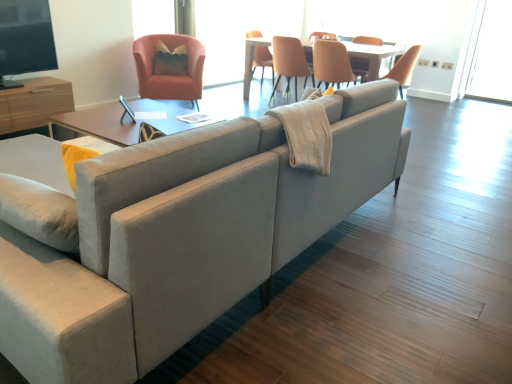
Question: Can you confirm if matte orange chair at upper center, which is the 2th chair from right to left, is bigger than leather-like beige chair at center, marked as the third chair in a left-to-right arrangement?

Choices:
 (A) no
 (B) yes

Answer: (B)

Question: Can you confirm if matte orange chair at upper center, which is the 2th chair from right to left, is smaller than leather-like beige chair at center, marked as the third chair in a left-to-right arrangement?

Choices:
 (A) yes
 (B) no

Answer: (B)

Question: Are matte orange chair at upper center, which is the 2th chair from right to left, and leather-like beige chair at center, marked as the third chair in a left-to-right arrangement, beside each other?

Choices:
 (A) yes
 (B) no

Answer: (B)

Question: From a real-world perspective, is matte orange chair at upper center, which is the 2th chair from right to left, below leather-like beige chair at center, marked as the third chair in a left-to-right arrangement?

Choices:
 (A) no
 (B) yes

Answer: (B)

Question: Could you tell me if matte orange chair at upper center, which ranks as the second chair in left-to-right order, is facing leather-like beige chair at center, the 1th chair viewed from the right?

Choices:
 (A) no
 (B) yes

Answer: (A)

Question: From a real-world perspective, does matte orange chair at upper center, which ranks as the second chair in left-to-right order, stand above leather-like beige chair at center, the 1th chair viewed from the right?

Choices:
 (A) yes
 (B) no

Answer: (B)

Question: From a real-world perspective, is light wood table at center physically below matte orange armchair at upper left, marked as the first chair in a left-to-right arrangement?

Choices:
 (A) no
 (B) yes

Answer: (B)

Question: Can you confirm if light wood table at center is positioned to the right of matte orange armchair at upper left, marked as the first chair in a left-to-right arrangement?

Choices:
 (A) yes
 (B) no

Answer: (A)

Question: Is matte orange armchair at upper left, which is counted as the third chair, starting from the right, located within light wood table at center?

Choices:
 (A) no
 (B) yes

Answer: (A)

Question: Is light wood table at center wider than matte orange armchair at upper left, which is counted as the third chair, starting from the right?

Choices:
 (A) no
 (B) yes

Answer: (B)

Question: Can you confirm if light wood table at center is smaller than matte orange armchair at upper left, marked as the first chair in a left-to-right arrangement?

Choices:
 (A) yes
 (B) no

Answer: (B)

Question: Is light wood table at center aimed at matte orange armchair at upper left, marked as the first chair in a left-to-right arrangement?

Choices:
 (A) no
 (B) yes

Answer: (B)

Question: Can you confirm if transparent glass window screen at upper center, the third window screen in the right-to-left sequence, is smaller than matte orange chair at upper center, which ranks as the second chair in left-to-right order?

Choices:
 (A) yes
 (B) no

Answer: (A)